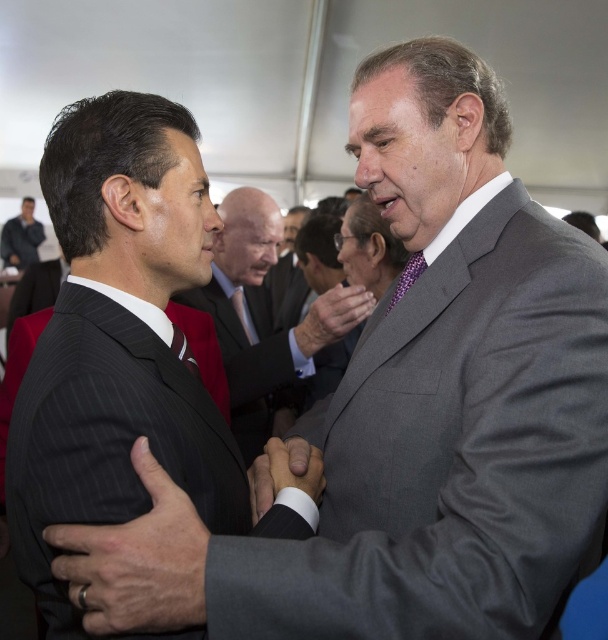
Which of these two, smooth black hand at center or matte black suit at upper left, stands shorter?

Standing shorter between the two is smooth black hand at center.

Where is `smooth black hand at center`? smooth black hand at center is located at coordinates (285, 472).

Identify the location of smooth black hand at center. (285, 472).

This screenshot has height=640, width=608. What are the coordinates of `smooth black hand at center` in the screenshot? It's located at (285, 472).

Which is behind, point (243, 444) or point (317, 333)?

The point (243, 444) is behind.

Is point (237, 371) behind point (322, 314)?

Yes, point (237, 371) is farther from viewer.

Locate an element on the screen. matte black suit at center is located at coordinates (246, 314).

Is pinstriped fabric suit at center above black pinstripe suit at center?

Indeed, pinstriped fabric suit at center is positioned over black pinstripe suit at center.

Describe the element at coordinates (114, 442) in the screenshot. I see `pinstriped fabric suit at center` at that location.

Who is more forward, (209, 493) or (108, 540)?

Positioned in front is point (108, 540).

The image size is (608, 640). I want to click on pinstriped fabric suit at center, so (x=114, y=442).